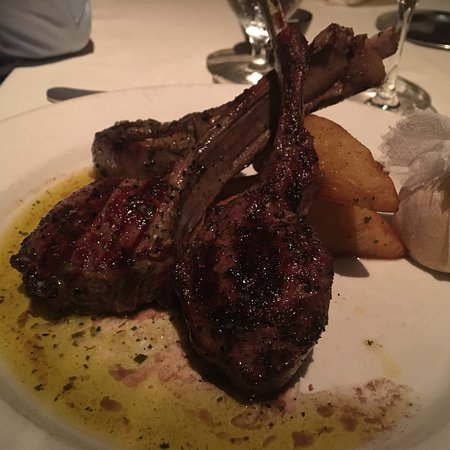
Image resolution: width=450 pixels, height=450 pixels. I want to click on base of wine glass, so click(401, 96), click(226, 63).